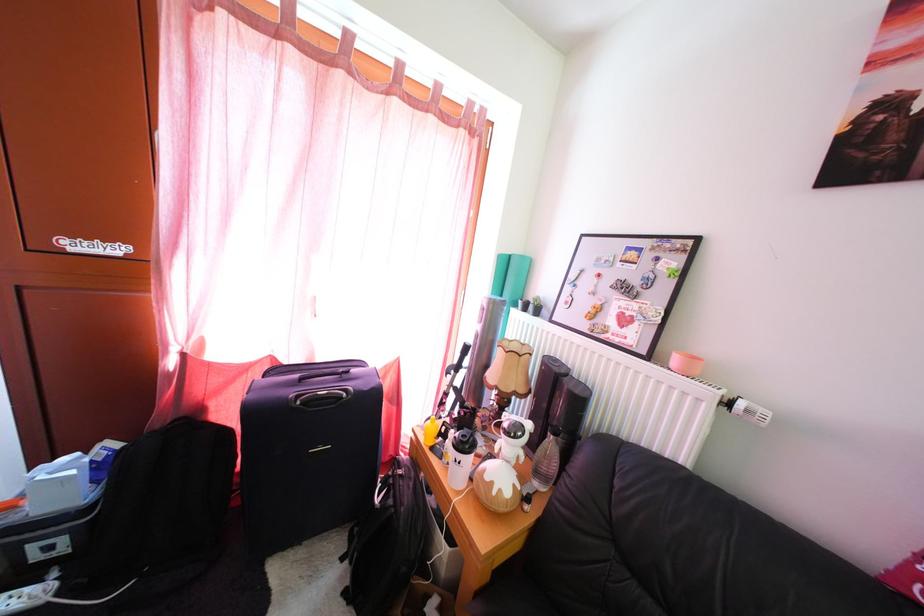
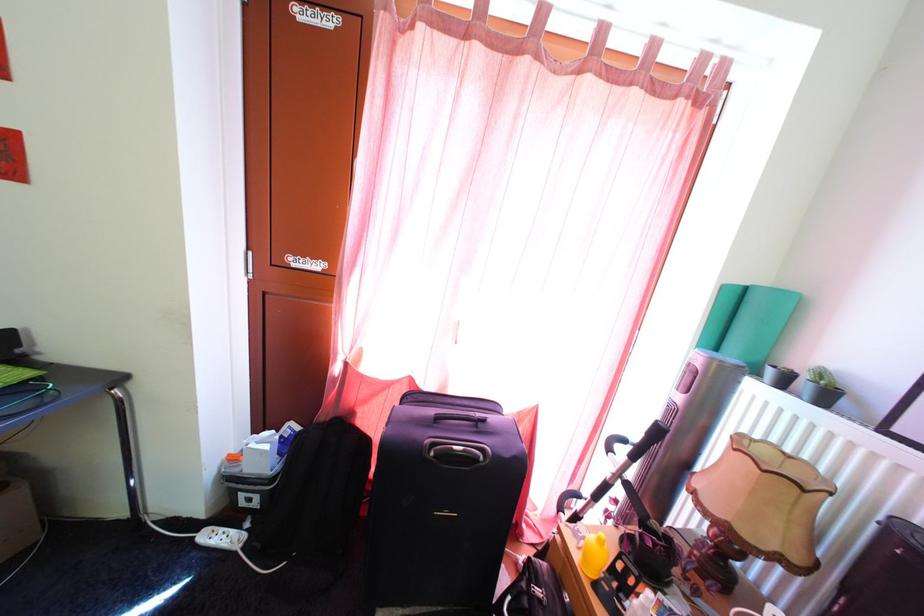
Question: The first image is from the beginning of the video and the second image is from the end. How did the camera likely rotate when shooting the video?

Choices:
 (A) Left
 (B) Right
 (C) Up
 (D) Down

Answer: (A)